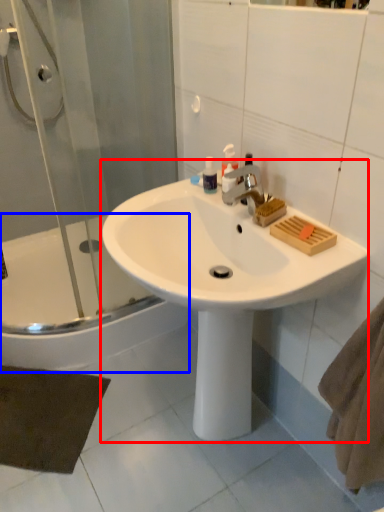
Question: Which of the following is the farthest to the observer, sink (highlighted by a red box) or bathtub (highlighted by a blue box)?

Choices:
 (A) sink
 (B) bathtub

Answer: (B)